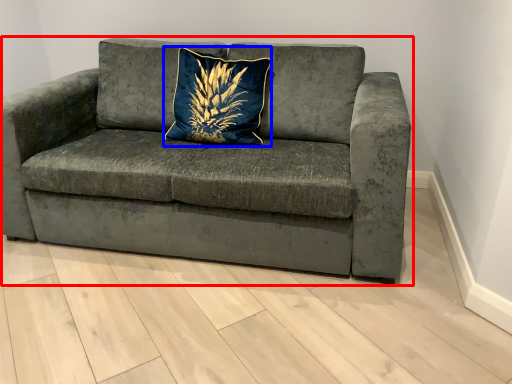
Question: Which object appears farthest to the camera in this image, studio couch (highlighted by a red box) or pillow (highlighted by a blue box)?

Choices:
 (A) studio couch
 (B) pillow

Answer: (B)